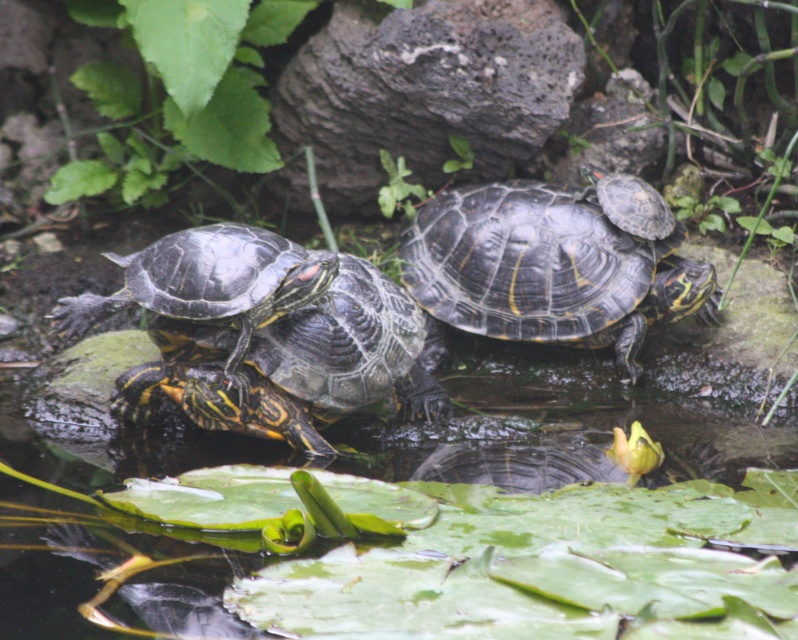
In the scene shown: You are a nature photographer observing the pond. You need to capture a photo where both the shiny black turtle at center and the shiny dark green tortoise at center are clearly visible. Based on their positions, which turtle should you focus on to ensure the other is in the background?

The shiny black turtle at center is positioned over the shiny dark green tortoise at center, so focusing on the shiny black turtle at center will keep the shiny dark green tortoise at center in the background.

You are a photographer trying to capture the shiny black turtle at center and the shiny dark green tortoise at center in a single shot. Since you want both subjects to be clearly visible, which turtle should you focus on first to ensure the other remains in focus?

You should focus on the shiny black turtle at center first because it is taller than the shiny dark green tortoise at center, so focusing on the taller turtle will help keep the shorter one in focus as well.

You are a photographer aiming to capture both the shiny black turtle at center and the shiny dark green tortoise at center in a single shot. Which turtle will appear closer to the camera in the photo?

The shiny black turtle at center will appear closer to the camera because it is positioned further to the viewer than the shiny dark green tortoise at center.